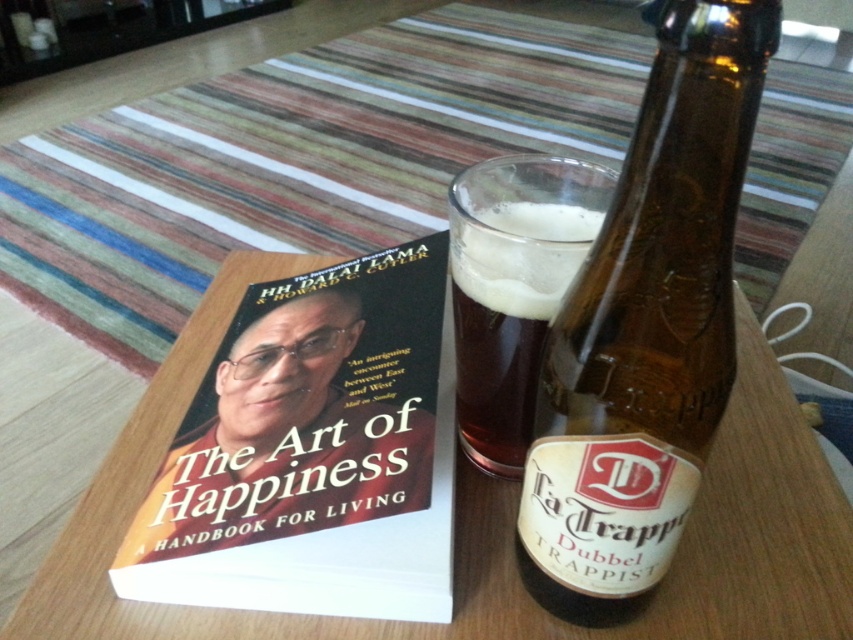
Question: Which object is positioned closest to the wooden table at center?

Choices:
 (A) brown glass beer bottle at center
 (B) white paper book at center

Answer: (B)

Question: Estimate the real-world distances between objects in this image. Which object is farther from the brown glass beer bottle at center?

Choices:
 (A) dark amber glass at center
 (B) white paper book at center
 (C) wooden table at center

Answer: (C)

Question: Which object is farther from the camera taking this photo?

Choices:
 (A) dark amber glass at center
 (B) wooden table at center

Answer: (B)

Question: Does wooden table at center come in front of dark amber glass at center?

Choices:
 (A) no
 (B) yes

Answer: (A)

Question: Does brown glass beer bottle at center have a larger size compared to dark amber glass at center?

Choices:
 (A) yes
 (B) no

Answer: (A)

Question: Is white paper book at center to the right of wooden table at center from the viewer's perspective?

Choices:
 (A) yes
 (B) no

Answer: (B)